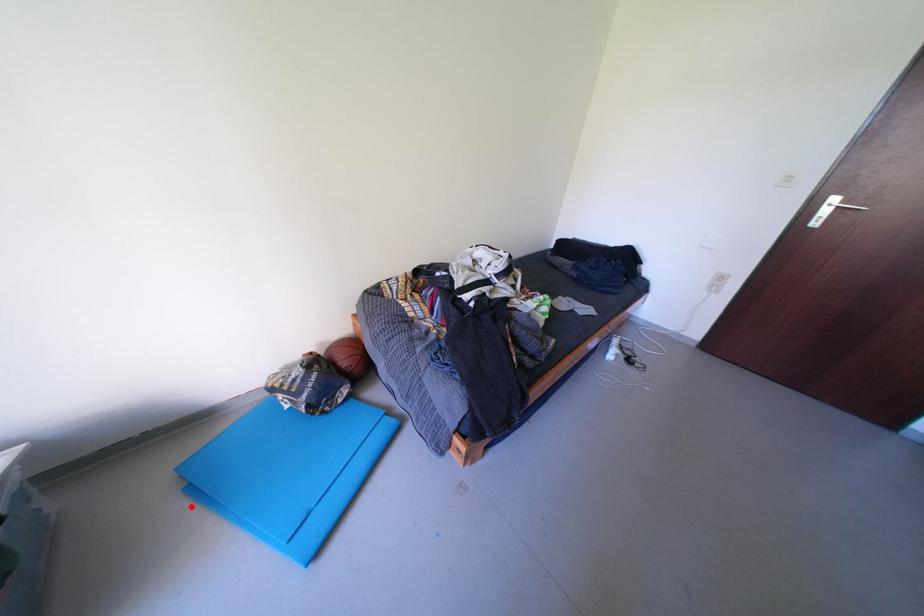
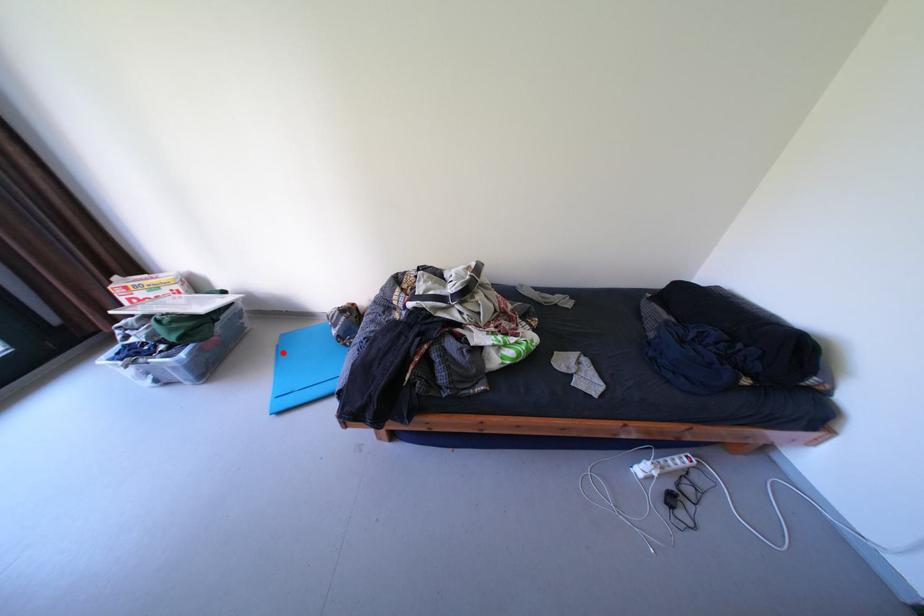
I am providing you with two images of the same scene from different viewpoints. A red point is marked on the first image and another point is marked on the second image. Is the marked point in image1 the same physical position as the marked point in image2?

Yes